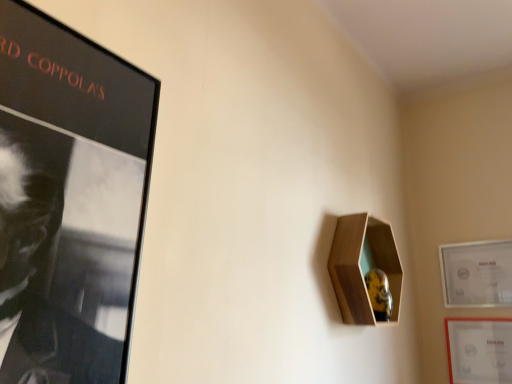
Question: Is matte white picture frame at right, placed as the first picture frame when sorted from top to bottom, outside wooden hexagonal shelf at upper right?

Choices:
 (A) no
 (B) yes

Answer: (B)

Question: Considering the relative positions of matte white picture frame at right, positioned as the 2th picture frame in bottom-to-top order, and wooden hexagonal shelf at upper right in the image provided, is matte white picture frame at right, positioned as the 2th picture frame in bottom-to-top order, in front of wooden hexagonal shelf at upper right?

Choices:
 (A) no
 (B) yes

Answer: (A)

Question: From the image's perspective, does matte white picture frame at right, positioned as the 2th picture frame in bottom-to-top order, appear higher than wooden hexagonal shelf at upper right?

Choices:
 (A) no
 (B) yes

Answer: (A)

Question: Can you confirm if matte white picture frame at right, positioned as the 2th picture frame in bottom-to-top order, is taller than wooden hexagonal shelf at upper right?

Choices:
 (A) yes
 (B) no

Answer: (B)

Question: Is matte white picture frame at right, positioned as the 2th picture frame in bottom-to-top order, thinner than wooden hexagonal shelf at upper right?

Choices:
 (A) no
 (B) yes

Answer: (B)

Question: Is matte white picture frame at right, placed as the first picture frame when sorted from top to bottom, to the left of wooden hexagonal shelf at upper right from the viewer's perspective?

Choices:
 (A) no
 (B) yes

Answer: (A)

Question: Does wooden hexagonal shelf at upper right have a greater width compared to matte white picture frame at lower right, which ranks as the first picture frame in bottom-to-top order?

Choices:
 (A) yes
 (B) no

Answer: (A)

Question: Can you confirm if wooden hexagonal shelf at upper right is taller than matte white picture frame at lower right, which ranks as the first picture frame in bottom-to-top order?

Choices:
 (A) no
 (B) yes

Answer: (B)

Question: Is wooden hexagonal shelf at upper right positioned with its back to matte white picture frame at lower right, which ranks as the first picture frame in bottom-to-top order?

Choices:
 (A) no
 (B) yes

Answer: (A)

Question: Is wooden hexagonal shelf at upper right not close to matte white picture frame at lower right, which is the 2th picture frame in top-to-bottom order?

Choices:
 (A) yes
 (B) no

Answer: (B)

Question: Does wooden hexagonal shelf at upper right appear on the right side of matte white picture frame at lower right, which is the 2th picture frame in top-to-bottom order?

Choices:
 (A) no
 (B) yes

Answer: (A)

Question: Can you confirm if wooden hexagonal shelf at upper right is thinner than matte white picture frame at lower right, which ranks as the first picture frame in bottom-to-top order?

Choices:
 (A) yes
 (B) no

Answer: (B)

Question: From a real-world perspective, is matte white picture frame at lower right, which ranks as the first picture frame in bottom-to-top order, physically above matte white picture frame at right, placed as the first picture frame when sorted from top to bottom?

Choices:
 (A) no
 (B) yes

Answer: (A)